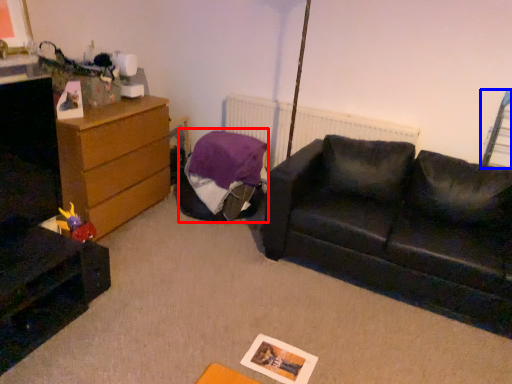
Question: Which point is further to the camera, bean bag chair (highlighted by a red box) or swivel chair (highlighted by a blue box)?

Choices:
 (A) bean bag chair
 (B) swivel chair

Answer: (A)